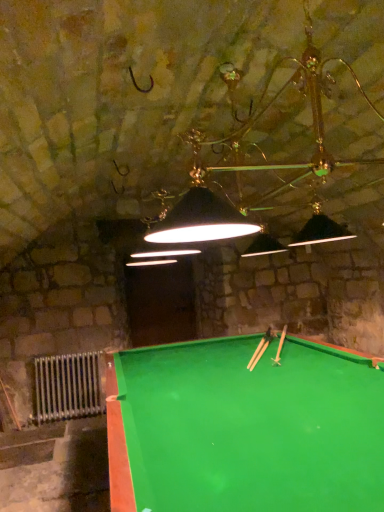
Question: Is silver metallic radiator at lower left next to green plastic cue at center, which ranks as the 1th cue in top-to-bottom order?

Choices:
 (A) no
 (B) yes

Answer: (A)

Question: Does silver metallic radiator at lower left have a greater height compared to green plastic cue at center, which is counted as the 2th cue, starting from the bottom?

Choices:
 (A) yes
 (B) no

Answer: (A)

Question: Considering the relative positions of silver metallic radiator at lower left and green plastic cue at center, which ranks as the 1th cue in top-to-bottom order, in the image provided, is silver metallic radiator at lower left behind green plastic cue at center, which ranks as the 1th cue in top-to-bottom order,?

Choices:
 (A) yes
 (B) no

Answer: (A)

Question: Is silver metallic radiator at lower left to the left of green plastic cue at center, which ranks as the 1th cue in top-to-bottom order, from the viewer's perspective?

Choices:
 (A) yes
 (B) no

Answer: (A)

Question: Could you tell me if silver metallic radiator at lower left is facing green plastic cue at center, which ranks as the 1th cue in top-to-bottom order?

Choices:
 (A) no
 (B) yes

Answer: (A)

Question: In terms of height, does silver metallic radiator at lower left look taller or shorter compared to wooden cue at center, positioned as the first cue in bottom-to-top order?

Choices:
 (A) tall
 (B) short

Answer: (A)

Question: Considering the positions of silver metallic radiator at lower left and wooden cue at center, the second cue positioned from the top, in the image, is silver metallic radiator at lower left bigger or smaller than wooden cue at center, the second cue positioned from the top,?

Choices:
 (A) big
 (B) small

Answer: (A)

Question: Is silver metallic radiator at lower left wider or thinner than wooden cue at center, positioned as the first cue in bottom-to-top order?

Choices:
 (A) wide
 (B) thin

Answer: (B)

Question: Does point (52, 359) appear closer or farther from the camera than point (268, 339)?

Choices:
 (A) farther
 (B) closer

Answer: (A)

Question: From the image's perspective, relative to silver metallic radiator at lower left, is green plastic cue at center, which ranks as the 1th cue in top-to-bottom order, above or below?

Choices:
 (A) above
 (B) below

Answer: (A)

Question: Is point (274, 361) positioned closer to the camera than point (91, 394)?

Choices:
 (A) farther
 (B) closer

Answer: (B)

Question: Looking at their shapes, would you say green plastic cue at center, which is counted as the 2th cue, starting from the bottom, is wider or thinner than silver metallic radiator at lower left?

Choices:
 (A) wide
 (B) thin

Answer: (A)

Question: Considering their positions, is green plastic cue at center, which is counted as the 2th cue, starting from the bottom, located in front of or behind silver metallic radiator at lower left?

Choices:
 (A) front
 (B) behind

Answer: (A)

Question: Looking at their shapes, would you say wooden cue at center, positioned as the first cue in bottom-to-top order, is wider or thinner than silver metallic radiator at lower left?

Choices:
 (A) thin
 (B) wide

Answer: (B)

Question: Is point (261, 352) positioned closer to the camera than point (41, 386)?

Choices:
 (A) farther
 (B) closer

Answer: (B)